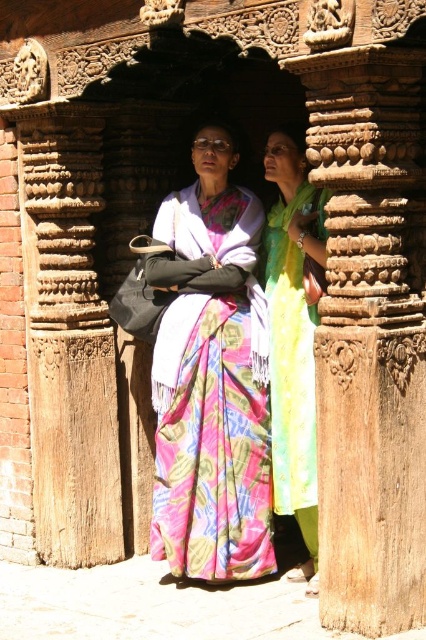
Which is below, printed silk sari at center or green silk dress at center?

green silk dress at center is below.

Who is more forward, (172, 572) or (273, 291)?

Point (172, 572) is more forward.

Is point (172, 513) closer to camera compared to point (287, 465)?

No, it is not.

Find the location of a particular element. printed silk sari at center is located at coordinates (212, 378).